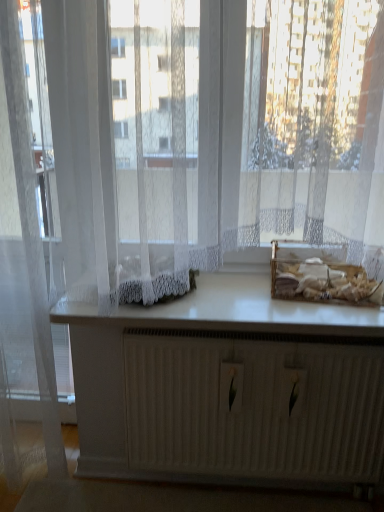
Question: Is white matte radiator at center in front of or behind white smooth countertop at center in the image?

Choices:
 (A) behind
 (B) front

Answer: (A)

Question: Looking at the image, does white matte radiator at center seem bigger or smaller compared to white smooth countertop at center?

Choices:
 (A) small
 (B) big

Answer: (B)

Question: Which object is the closest to the white matte radiator at center?

Choices:
 (A) white lace curtains at center
 (B) white smooth countertop at center
 (C) translucent plastic basket at center
 (D) translucent white curtain at left

Answer: (B)

Question: Which object is the farthest from the translucent plastic basket at center?

Choices:
 (A) translucent white curtain at left
 (B) white smooth countertop at center
 (C) white matte radiator at center
 (D) white lace curtains at center

Answer: (A)